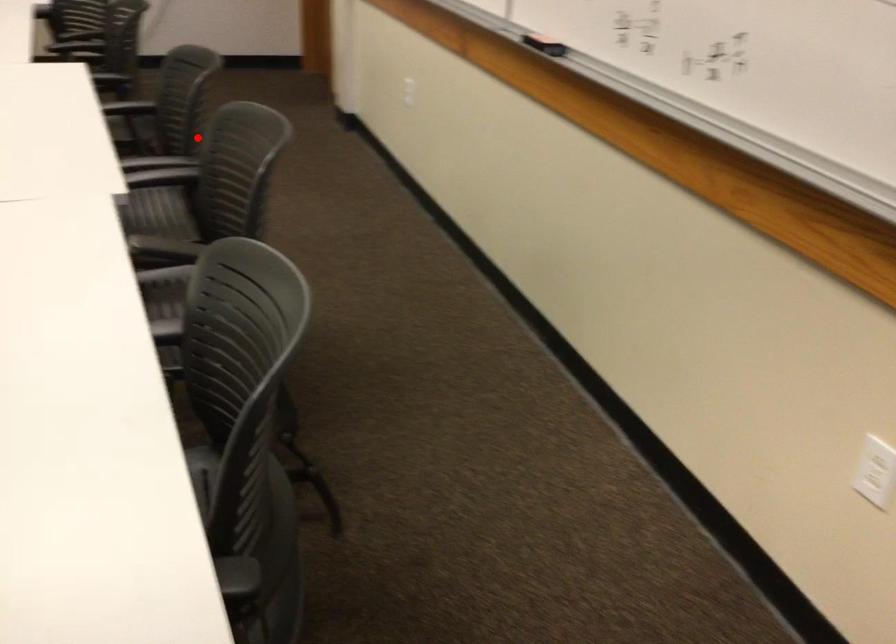
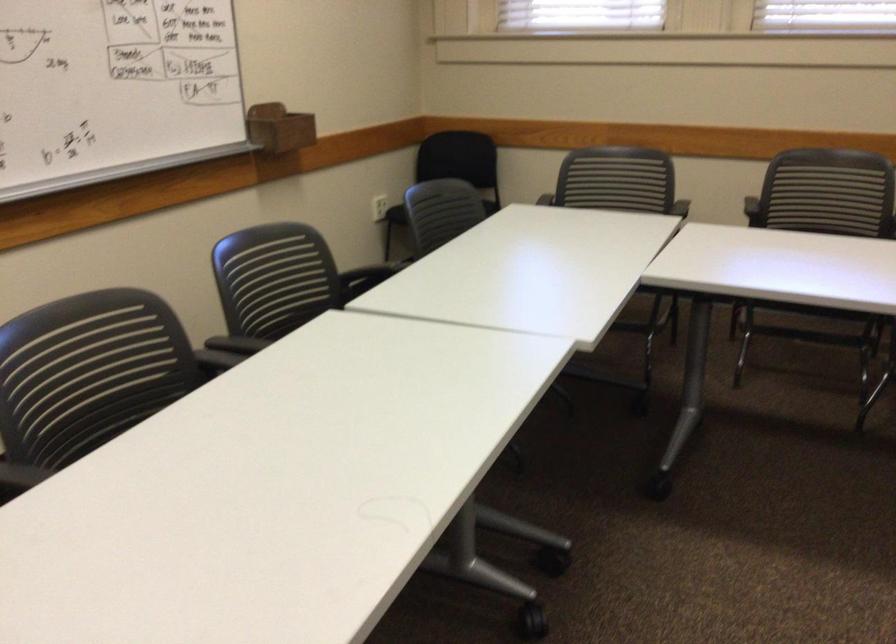
Where in the second image is the point corresponding to the highlighted location from the first image?

(125, 375)